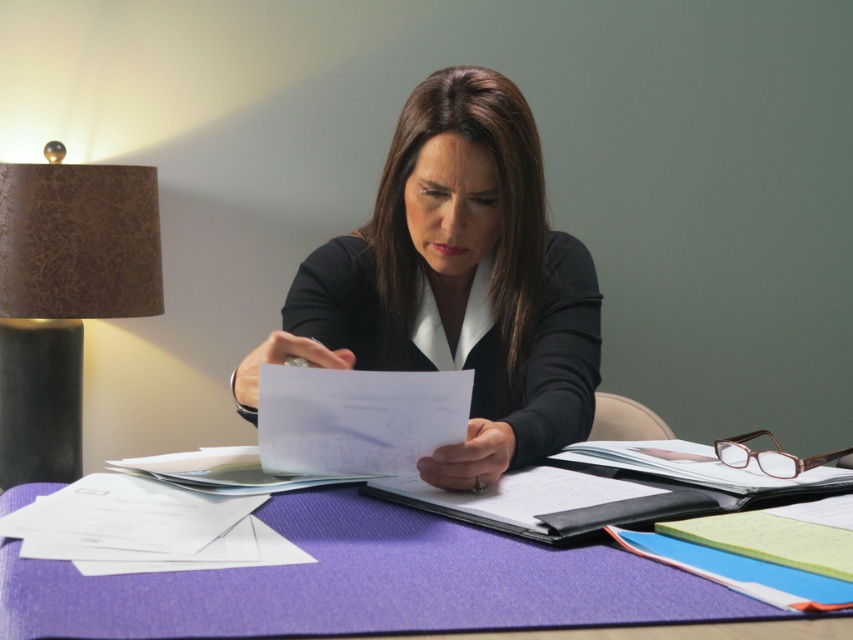
Between black matte blazer at center and brown textured lampshade at left, which one has less height?

With less height is black matte blazer at center.

Consider the image. Who is lower down, black matte blazer at center or brown textured lampshade at left?

Positioned lower is brown textured lampshade at left.

The height and width of the screenshot is (640, 853). Identify the location of black matte blazer at center. (456, 282).

Which of these two, brown textured lampshade at left or black leather notebook at center, stands shorter?

black leather notebook at center is shorter.

Can you confirm if brown textured lampshade at left is wider than black leather notebook at center?

Yes, brown textured lampshade at left is wider than black leather notebook at center.

What do you see at coordinates (64, 298) in the screenshot? I see `brown textured lampshade at left` at bounding box center [64, 298].

Image resolution: width=853 pixels, height=640 pixels. In order to click on brown textured lampshade at left in this screenshot , I will do 64,298.

Which is in front, point (471, 148) or point (325, 624)?

Point (325, 624) is more forward.

Who is lower down, black matte blazer at center or purple fabric at center?

purple fabric at center

Who is more forward, (457,212) or (212,634)?

→ Point (212,634)

I want to click on black matte blazer at center, so click(x=456, y=282).